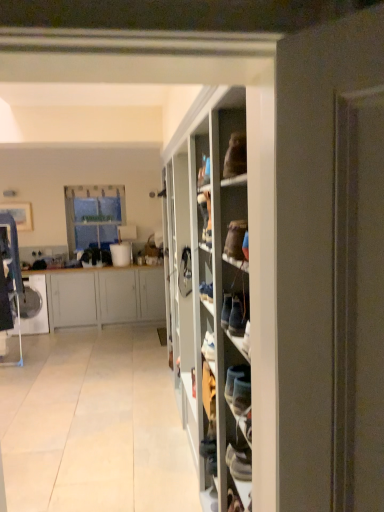
Question: Is the position of white tile floor at center less distant than that of white matte cabinet at left?

Choices:
 (A) no
 (B) yes

Answer: (B)

Question: Does white tile floor at center come behind white matte cabinet at left?

Choices:
 (A) yes
 (B) no

Answer: (B)

Question: Is white tile floor at center thinner than white matte cabinet at left?

Choices:
 (A) yes
 (B) no

Answer: (B)

Question: Considering the relative positions of white tile floor at center and white matte cabinet at left in the image provided, is white tile floor at center to the right of white matte cabinet at left from the viewer's perspective?

Choices:
 (A) yes
 (B) no

Answer: (A)

Question: From the image's perspective, is white tile floor at center located beneath white matte cabinet at left?

Choices:
 (A) no
 (B) yes

Answer: (B)

Question: From the image's perspective, is white tile floor at center located above white matte cabinet at left?

Choices:
 (A) no
 (B) yes

Answer: (A)

Question: From the image's perspective, is white matte cabinet at left under white tile floor at center?

Choices:
 (A) no
 (B) yes

Answer: (A)

Question: From the image's perspective, is white matte cabinet at left above white tile floor at center?

Choices:
 (A) yes
 (B) no

Answer: (A)

Question: Can we say white matte cabinet at left lies outside white tile floor at center?

Choices:
 (A) yes
 (B) no

Answer: (A)

Question: Is white tile floor at center at the back of white matte cabinet at left?

Choices:
 (A) yes
 (B) no

Answer: (B)

Question: Can you confirm if white matte cabinet at left is positioned to the left of white tile floor at center?

Choices:
 (A) no
 (B) yes

Answer: (B)

Question: Is white matte cabinet at left positioned in front of white tile floor at center?

Choices:
 (A) no
 (B) yes

Answer: (A)

Question: Is clear glass window at upper left oriented away from white matte cabinet at left?

Choices:
 (A) no
 (B) yes

Answer: (A)